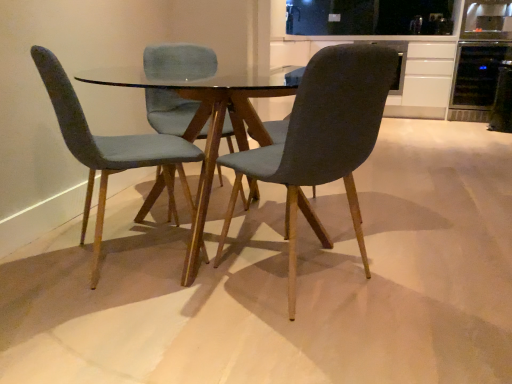
Question: Is transparent glass table at center aimed at dark gray fabric chair at center, which is counted as the second chair, starting from the left?

Choices:
 (A) no
 (B) yes

Answer: (B)

Question: From a real-world perspective, is transparent glass table at center located beneath dark gray fabric chair at center, which is counted as the second chair, starting from the left?

Choices:
 (A) no
 (B) yes

Answer: (B)

Question: Is transparent glass table at center further to camera compared to dark gray fabric chair at center, which is counted as the second chair, starting from the left?

Choices:
 (A) no
 (B) yes

Answer: (B)

Question: Is transparent glass table at center shorter than dark gray fabric chair at center, acting as the 1th chair starting from the right?

Choices:
 (A) yes
 (B) no

Answer: (A)

Question: Can dark gray fabric chair at center, acting as the 1th chair starting from the right, be found inside transparent glass table at center?

Choices:
 (A) no
 (B) yes

Answer: (B)

Question: From the image's perspective, is transparent glass table at center on top of dark gray fabric chair at center, acting as the 1th chair starting from the right?

Choices:
 (A) yes
 (B) no

Answer: (A)

Question: Can you confirm if black glass refrigerator at upper right, marked as the first appliance in a front-to-back arrangement, is thinner than velvet teal chair at left, arranged as the 2th chair when viewed from the right?

Choices:
 (A) no
 (B) yes

Answer: (B)

Question: Can you confirm if black glass refrigerator at upper right, marked as the first appliance in a front-to-back arrangement, is taller than velvet teal chair at left, arranged as the 2th chair when viewed from the right?

Choices:
 (A) yes
 (B) no

Answer: (B)

Question: From a real-world perspective, is black glass refrigerator at upper right, marked as the first appliance in a front-to-back arrangement, on top of velvet teal chair at left, arranged as the 2th chair when viewed from the right?

Choices:
 (A) yes
 (B) no

Answer: (B)

Question: Can you confirm if black glass refrigerator at upper right, which appears as the 2th appliance when viewed from the back, is wider than velvet teal chair at left, the 1th chair in the left-to-right sequence?

Choices:
 (A) no
 (B) yes

Answer: (A)

Question: From the image's perspective, is black glass refrigerator at upper right, which appears as the 2th appliance when viewed from the back, located beneath velvet teal chair at left, arranged as the 2th chair when viewed from the right?

Choices:
 (A) yes
 (B) no

Answer: (B)

Question: Does black glass refrigerator at upper right, marked as the first appliance in a front-to-back arrangement, have a lesser height compared to velvet teal chair at left, the 1th chair in the left-to-right sequence?

Choices:
 (A) no
 (B) yes

Answer: (B)

Question: Is dark gray fabric chair at center, which is counted as the second chair, starting from the left, not close to white matte cabinet at upper right?

Choices:
 (A) yes
 (B) no

Answer: (A)